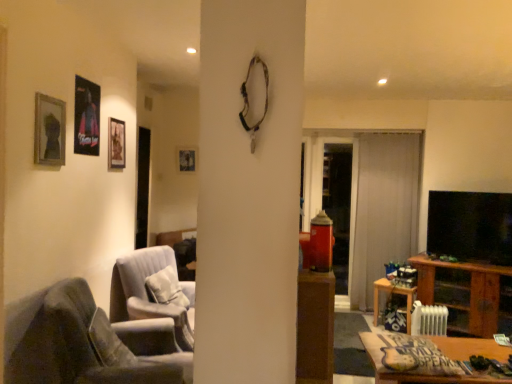
The image size is (512, 384). Identify the location of wooden table at lower right, the 2th table in the back-to-front sequence. (440, 356).

Measure the distance between point (121, 164) and camera.

The depth of point (121, 164) is 3.19 meters.

Consider the image. What is the approximate width of matte black picture frame at upper left, which is the 3th picture frame from front to back?

The width of matte black picture frame at upper left, which is the 3th picture frame from front to back, is 0.99 inches.

Measure the distance between point [188,170] and camera.

Point [188,170] is 4.84 meters away from camera.

From the picture: Measure the distance between point (83, 292) and camera.

The distance of point (83, 292) from camera is 2.15 meters.

Locate an element on the screen. The height and width of the screenshot is (384, 512). wooden table at lower right, which is the 2th table from top to bottom is located at coordinates (395, 294).

Locate an element on the screen. This screenshot has height=384, width=512. metallic poster at upper left, the 2th picture frame from the front is located at coordinates (86, 117).

From the image's perspective, which object appears higher, white sheer curtain at center or wooden frame at upper left, which ranks as the first picture frame in left-to-right order?

wooden frame at upper left, which ranks as the first picture frame in left-to-right order, from the image's perspective.

Between point (397, 260) and point (61, 134), which one is positioned in front?

The point (61, 134) is more forward.

Considering the relative positions of wooden table at lower right, arranged as the 1th table when ordered from the bottom, and matte black picture frame at upper left, positioned as the 2th picture frame in back-to-front order, in the image provided, is wooden table at lower right, arranged as the 1th table when ordered from the bottom, to the left of matte black picture frame at upper left, positioned as the 2th picture frame in back-to-front order, from the viewer's perspective?

No, wooden table at lower right, arranged as the 1th table when ordered from the bottom, is not to the left of matte black picture frame at upper left, positioned as the 2th picture frame in back-to-front order.

Consider the image. From a real-world perspective, is wooden table at lower right, which is the 2th table from top to bottom, physically below matte black picture frame at upper left, the third picture frame from the left?

Indeed, from a real-world perspective, wooden table at lower right, which is the 2th table from top to bottom, is positioned beneath matte black picture frame at upper left, the third picture frame from the left.

Between wooden table at lower right, arranged as the 1th table when ordered from the bottom, and matte black picture frame at upper left, which is counted as the 2th picture frame, starting from the right, which one has more height?

Standing taller between the two is wooden table at lower right, arranged as the 1th table when ordered from the bottom.

Is wooden table at lower right, which is the first table from back to front, turned away from matte black picture frame at upper left, the third picture frame from the left?

No, wooden table at lower right, which is the first table from back to front, is not facing away from matte black picture frame at upper left, the third picture frame from the left.

Is wooden cabinet at right facing away from suede-like gray pillow at lower left?

No, wooden cabinet at right's orientation is not away from suede-like gray pillow at lower left.

Can you tell me how much wooden cabinet at right and suede-like gray pillow at lower left differ in facing direction?

141 degrees.

Consider the image. From a real-world perspective, which is physically below, wooden cabinet at right or suede-like gray pillow at lower left?

From a 3D spatial view, wooden cabinet at right is below.

Is wooden cabinet at right closer to camera compared to suede-like gray pillow at lower left?

No, wooden cabinet at right is further to the viewer.

Which of these two, wooden table at lower right, which is the 1th table in left-to-right order, or suede-like gray pillow at lower left, is thinner?

With smaller width is suede-like gray pillow at lower left.

Between wooden table at lower right, acting as the 1th table starting from the front, and suede-like gray pillow at lower left, which one has more height?

With more height is suede-like gray pillow at lower left.

Consider the image. Based on their sizes in the image, would you say wooden table at lower right, acting as the 1th table starting from the front, is bigger or smaller than suede-like gray pillow at lower left?

wooden table at lower right, acting as the 1th table starting from the front, is smaller than suede-like gray pillow at lower left.

Is wooden table at lower right, arranged as the second table when ordered from the bottom, facing away from suede-like gray pillow at lower left?

No, wooden table at lower right, arranged as the second table when ordered from the bottom, is not facing away from suede-like gray pillow at lower left.

Based on the photo, is suede-like gray pillow at lower left facing away from wooden cabinet at right?

No.

From a real-world perspective, who is located lower, suede-like gray pillow at lower left or wooden cabinet at right?

In real-world perspective, wooden cabinet at right is lower.

Find the location of a particular element. The width and height of the screenshot is (512, 384). cabinetry lying on the right of suede-like gray pillow at lower left is located at coordinates tap(470, 289).

Considering the sizes of objects white sheer curtain at center and metallic poster at upper left, the 2th picture frame from the front, in the image provided, who is smaller, white sheer curtain at center or metallic poster at upper left, the 2th picture frame from the front,?

metallic poster at upper left, the 2th picture frame from the front, is smaller.

Identify the location of picture frame that is the 3rd object to the left of the white sheer curtain at center, starting at the anchor. (86, 117).

Considering the relative positions of white sheer curtain at center and metallic poster at upper left, positioned as the 3th picture frame in right-to-left order, in the image provided, is white sheer curtain at center to the left or to the right of metallic poster at upper left, positioned as the 3th picture frame in right-to-left order,?

white sheer curtain at center is to the right of metallic poster at upper left, positioned as the 3th picture frame in right-to-left order.

Looking at their sizes, would you say white sheer curtain at center is wider or thinner than metallic poster at upper left, the 2th picture frame from the front?

In the image, white sheer curtain at center appears to be wider than metallic poster at upper left, the 2th picture frame from the front.

Looking at this image, how distant is white sheer curtain at center from black glossy flat-screen tv at right?

26.31 inches.

Would you consider white sheer curtain at center to be distant from black glossy flat-screen tv at right?

No, white sheer curtain at center is in close proximity to black glossy flat-screen tv at right.

Which object is positioned more to the right, white sheer curtain at center or black glossy flat-screen tv at right?

black glossy flat-screen tv at right is more to the right.

From a real-world perspective, is white sheer curtain at center beneath black glossy flat-screen tv at right?

Yes, from a real-world perspective, white sheer curtain at center is beneath black glossy flat-screen tv at right.

Locate an element on the screen. This screenshot has width=512, height=384. curtain behind the wooden frame at upper left, which is counted as the first picture frame, starting from the front is located at coordinates (383, 209).

In order to click on the 2nd table directly beneath the matte black picture frame at upper left, which is counted as the 2th picture frame, starting from the right (from a real-world perspective) in this screenshot , I will do (x=395, y=294).

Which object lies nearer to the anchor point velvet grey armchair at lower left, the first chair positioned from the front, velvet white armchair at center, marked as the first chair in a back-to-front arrangement, or wooden cabinet at right?

velvet white armchair at center, marked as the first chair in a back-to-front arrangement, lies closer to velvet grey armchair at lower left, the first chair positioned from the front, than the other object.

Looking at the image, which one is located further to wooden table at lower right, which appears as the second table when viewed from the right, matte black picture frame at upper center, which appears as the 4th picture frame when viewed from the left, or suede-like gray pillow at lower left?

matte black picture frame at upper center, which appears as the 4th picture frame when viewed from the left.

Considering their positions, is wooden table at lower right, arranged as the second table when ordered from the bottom, positioned closer to wooden cabinet at right than black glossy flat-screen tv at right?

black glossy flat-screen tv at right.

Consider the image. From the image, which object appears to be nearer to matte black picture frame at upper center, the fourth picture frame from the front, transparent glass door at center or velvet grey armchair at lower left, the first chair positioned from the front?

Based on the image, transparent glass door at center appears to be nearer to matte black picture frame at upper center, the fourth picture frame from the front.

When comparing their distances from transparent glass door at center, does matte black picture frame at upper left, the third picture frame from the left, or matte black picture frame at upper center, the first picture frame when ordered from back to front, seem further?

matte black picture frame at upper left, the third picture frame from the left.

Which object lies further to the anchor point velvet white armchair at center, marked as the first chair in a back-to-front arrangement, wooden table at lower right, the first table viewed from the right, or matte black picture frame at upper left, the third picture frame from the left?

Among the two, wooden table at lower right, the first table viewed from the right, is located further to velvet white armchair at center, marked as the first chair in a back-to-front arrangement.

Looking at the image, which one is located closer to wooden table at lower right, marked as the 2th table in a left-to-right arrangement, wooden frame at upper left, placed as the 4th picture frame when sorted from right to left, or metallic poster at upper left, the 2th picture frame from the front?

metallic poster at upper left, the 2th picture frame from the front, lies closer to wooden table at lower right, marked as the 2th table in a left-to-right arrangement, than the other object.

Considering their positions, is matte black picture frame at upper left, which is the 3th picture frame from front to back, positioned further to velvet grey armchair at lower left, the second chair from the back, than suede-like gray pillow at lower left?

matte black picture frame at upper left, which is the 3th picture frame from front to back, lies further to velvet grey armchair at lower left, the second chair from the back, than the other object.

I want to click on glass door located between matte black picture frame at upper left, which is the 3th picture frame from front to back, and black glossy flat-screen tv at right in the left-right direction, so click(x=338, y=206).

Identify the location of cabinetry between wooden table at lower right, arranged as the second table when ordered from the bottom, and transparent glass door at center, along the z-axis. This screenshot has width=512, height=384. (470, 289).

The height and width of the screenshot is (384, 512). I want to click on chair positioned between wooden table at lower right, the 2th table in the back-to-front sequence, and transparent glass door at center from near to far, so click(x=146, y=293).

The height and width of the screenshot is (384, 512). I want to click on chair positioned between velvet grey armchair at lower left, the second chair from the back, and matte black picture frame at upper center, which appears as the 4th picture frame when viewed from the left, from near to far, so click(x=146, y=293).